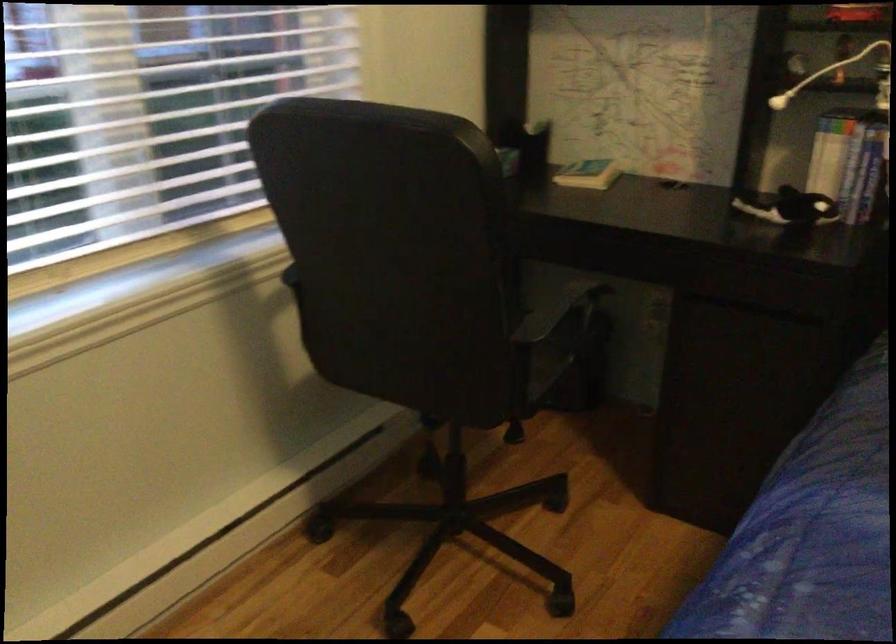
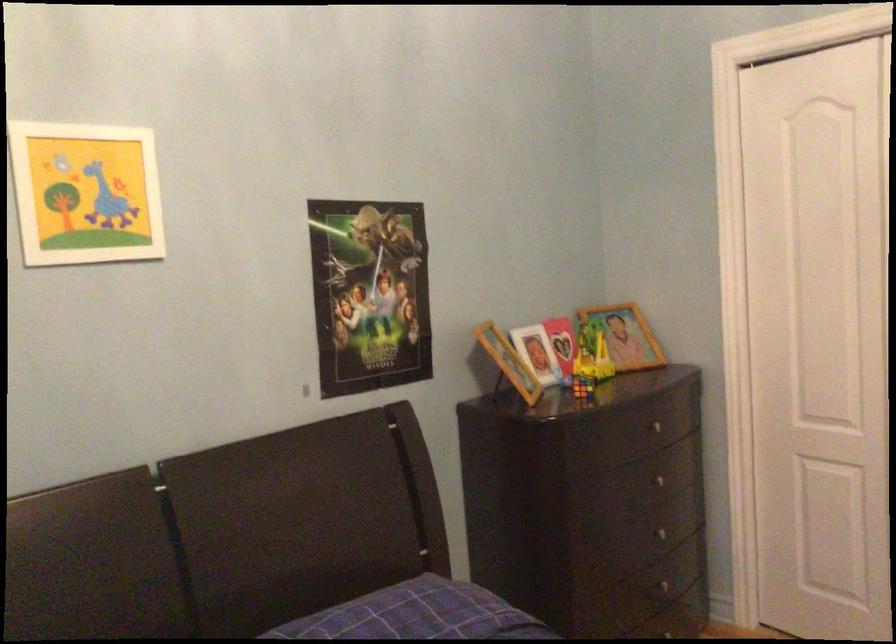
Question: The camera is either moving clockwise (left) or counter-clockwise (right) around the object. The first image is from the beginning of the video and the second image is from the end. Is the camera moving left or right when shooting the video?

Choices:
 (A) Left
 (B) Right

Answer: (A)